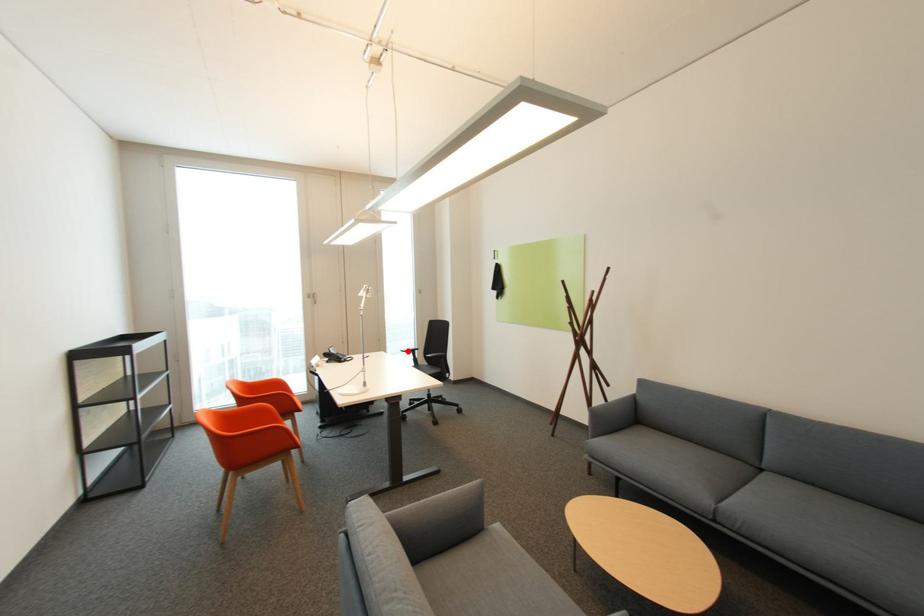
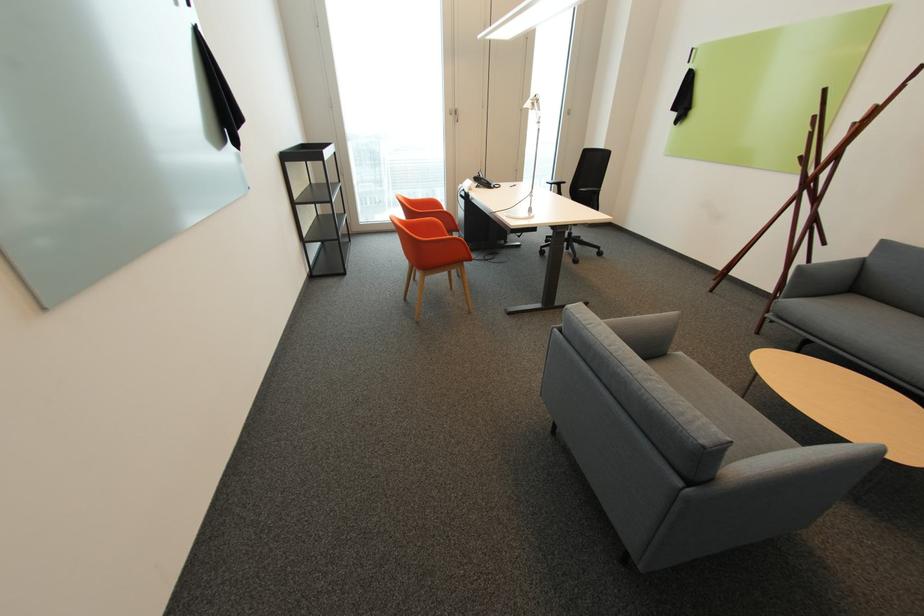
Find the pixel in the second image that matches the highlighted location in the first image.

(553, 183)